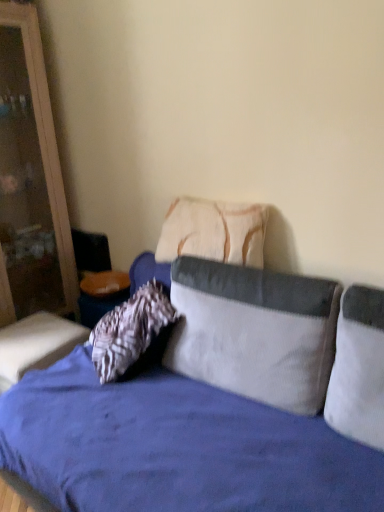
Question: Which direction should I rotate to face textured beige pillow at center, placed as the 3th pillow when sorted from front to back, — up or down?

Choices:
 (A) up
 (B) down

Answer: (A)

Question: Is wooden dresser at left taller than white corduroy pillow at right, the 3th pillow viewed from the back?

Choices:
 (A) yes
 (B) no

Answer: (A)

Question: Can you confirm if wooden dresser at left is smaller than white corduroy pillow at right, the 3th pillow viewed from the back?

Choices:
 (A) no
 (B) yes

Answer: (A)

Question: Is wooden dresser at left bigger than white corduroy pillow at right, the 1th pillow positioned from the front?

Choices:
 (A) yes
 (B) no

Answer: (A)

Question: Considering the relative positions of wooden dresser at left and white corduroy pillow at right, the 3th pillow viewed from the back, in the image provided, is wooden dresser at left to the left of white corduroy pillow at right, the 3th pillow viewed from the back, from the viewer's perspective?

Choices:
 (A) yes
 (B) no

Answer: (A)

Question: Does wooden dresser at left lie behind white corduroy pillow at right, the 1th pillow positioned from the front?

Choices:
 (A) no
 (B) yes

Answer: (B)

Question: Is wooden dresser at left closer to camera compared to white corduroy pillow at right, the 3th pillow viewed from the back?

Choices:
 (A) no
 (B) yes

Answer: (A)

Question: Is white corduroy pillow at center, acting as the 2th pillow starting from the front, facing towards white corduroy pillow at right, the 3th pillow viewed from the back?

Choices:
 (A) yes
 (B) no

Answer: (B)

Question: Considering the relative positions of white corduroy pillow at center, acting as the 2th pillow starting from the front, and white corduroy pillow at right, the 3th pillow viewed from the back, in the image provided, is white corduroy pillow at center, acting as the 2th pillow starting from the front, behind white corduroy pillow at right, the 3th pillow viewed from the back,?

Choices:
 (A) no
 (B) yes

Answer: (B)

Question: Is white corduroy pillow at center, the second pillow when ordered from back to front, to the right of white corduroy pillow at right, the 3th pillow viewed from the back, from the viewer's perspective?

Choices:
 (A) no
 (B) yes

Answer: (A)

Question: Is white corduroy pillow at center, acting as the 2th pillow starting from the front, oriented away from white corduroy pillow at right, the 1th pillow positioned from the front?

Choices:
 (A) yes
 (B) no

Answer: (B)

Question: Considering the relative sizes of white corduroy pillow at center, acting as the 2th pillow starting from the front, and white corduroy pillow at right, the 1th pillow positioned from the front, in the image provided, is white corduroy pillow at center, acting as the 2th pillow starting from the front, thinner than white corduroy pillow at right, the 1th pillow positioned from the front,?

Choices:
 (A) no
 (B) yes

Answer: (A)

Question: Is the depth of white corduroy pillow at center, the second pillow when ordered from back to front, less than that of white corduroy pillow at right, the 3th pillow viewed from the back?

Choices:
 (A) no
 (B) yes

Answer: (A)

Question: Considering the relative sizes of wooden dresser at left and white corduroy pillow at center, acting as the 2th pillow starting from the front, in the image provided, is wooden dresser at left smaller than white corduroy pillow at center, acting as the 2th pillow starting from the front,?

Choices:
 (A) no
 (B) yes

Answer: (A)